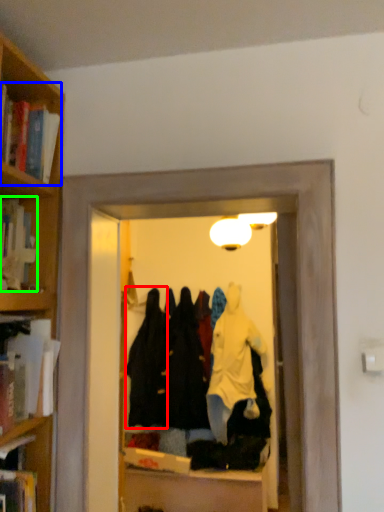
Question: Considering the real-world distances, which object is closest to clothing (highlighted by a red box)? book (highlighted by a blue box) or book (highlighted by a green box).

Choices:
 (A) book
 (B) book

Answer: (B)